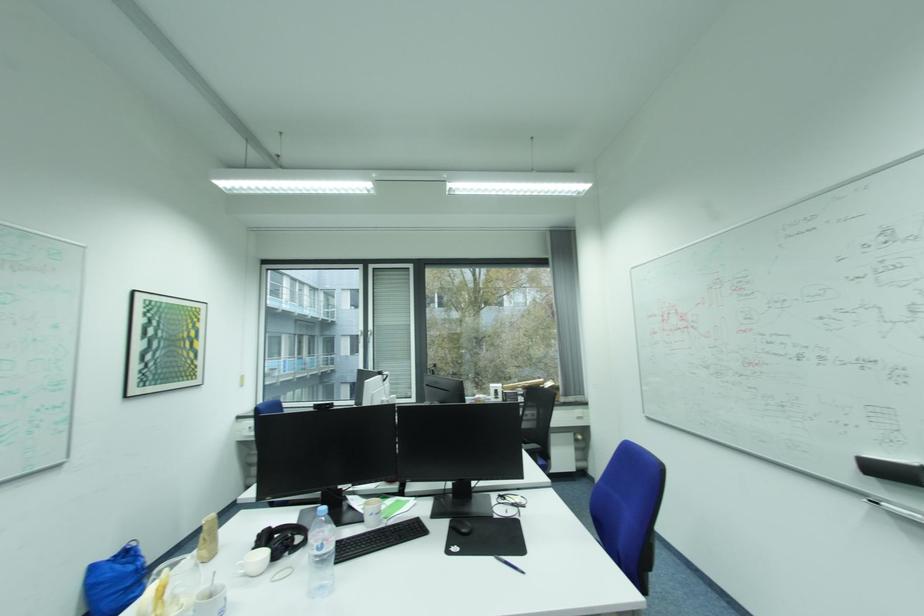
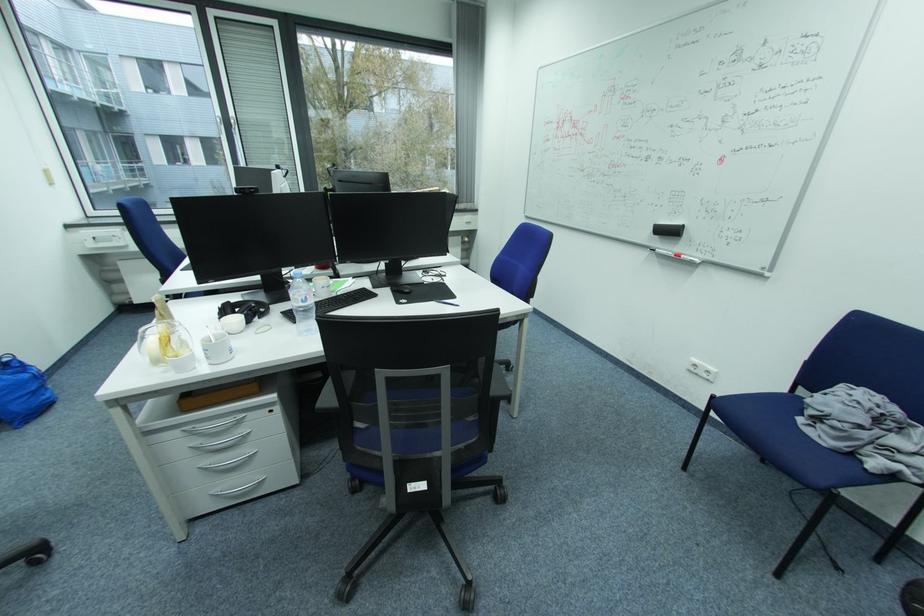
In the second image, find the point that corresponds to [287,546] in the first image.

(259, 313)